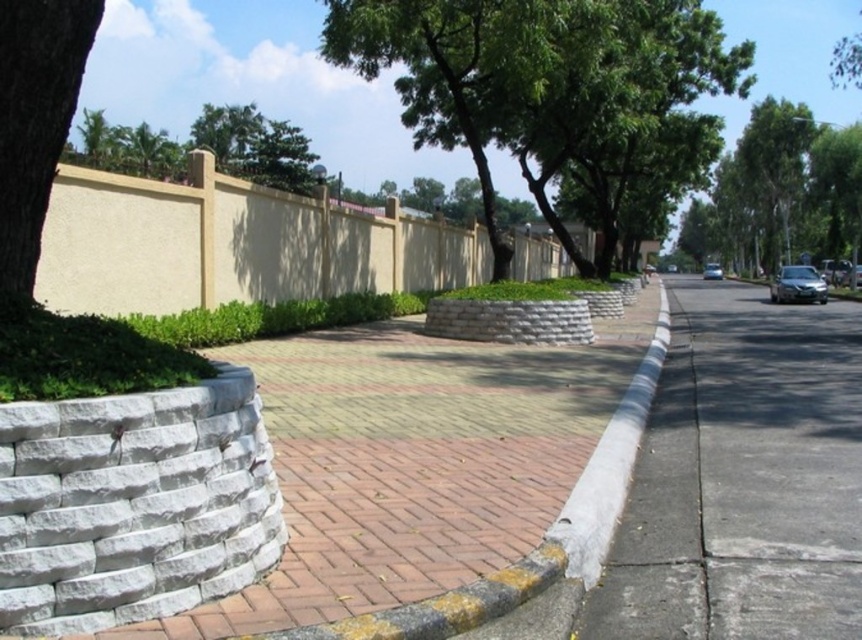
Can you confirm if green leafy tree at upper center is positioned below sleek silver sedan at right?

No, green leafy tree at upper center is not below sleek silver sedan at right.

Does green leafy tree at upper center have a larger size compared to sleek silver sedan at right?

Yes, green leafy tree at upper center is bigger than sleek silver sedan at right.

Image resolution: width=862 pixels, height=640 pixels. Find the location of `green leafy tree at upper center`. green leafy tree at upper center is located at coordinates (202, 147).

Who is taller, gray concrete sidewalk at center or green leafy tree at center?

green leafy tree at center is taller.

Where is `gray concrete sidewalk at center`? Image resolution: width=862 pixels, height=640 pixels. gray concrete sidewalk at center is located at coordinates (742, 477).

Can you confirm if green leafy tree at center is shorter than green leafy tree at upper center?

No.

From the picture: Who is more forward, (503, 140) or (229, 160)?

Point (503, 140) is more forward.

What do you see at coordinates (535, 77) in the screenshot?
I see `green leafy tree at center` at bounding box center [535, 77].

Image resolution: width=862 pixels, height=640 pixels. I want to click on green leafy tree at center, so click(535, 77).